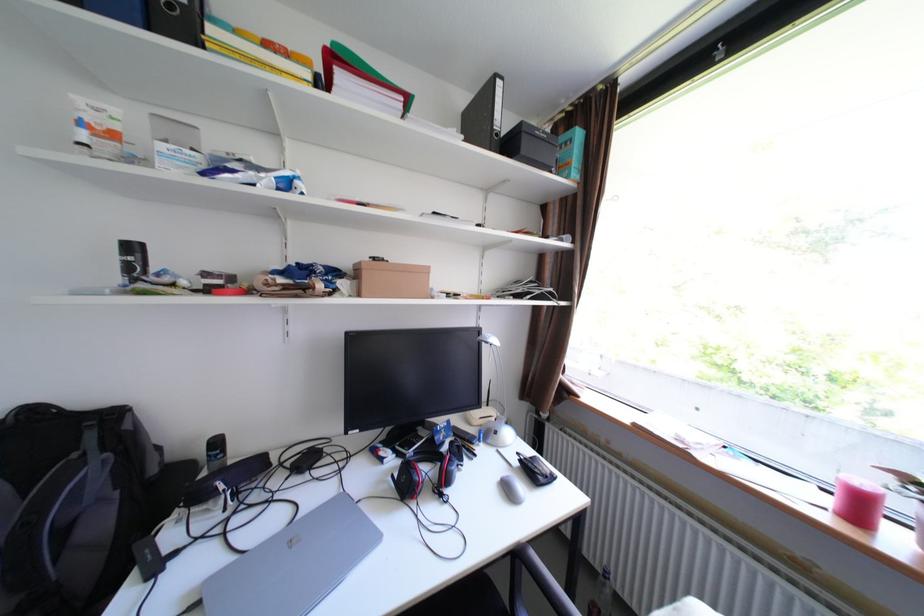
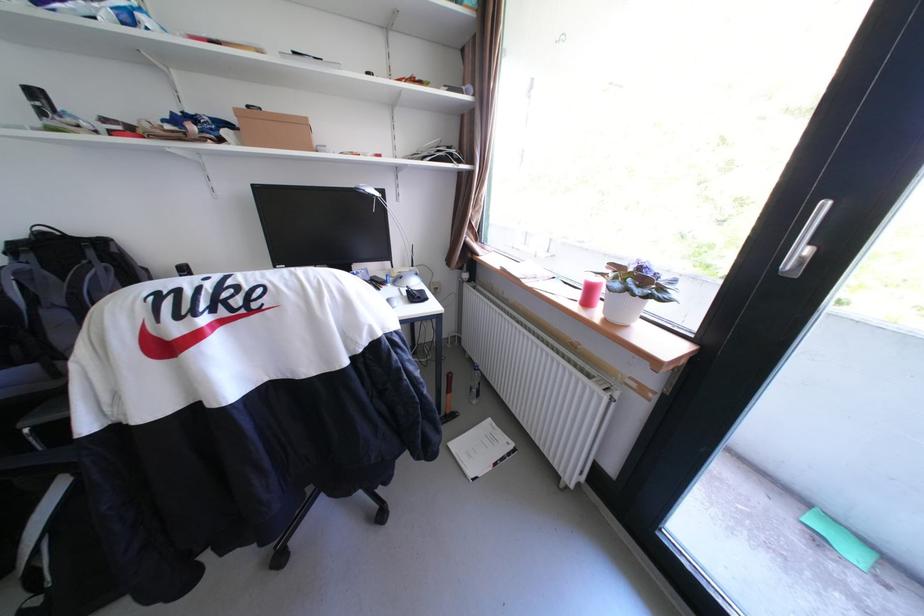
Locate, in the second image, the point that corresponds to (x=531, y=461) in the first image.

(418, 291)